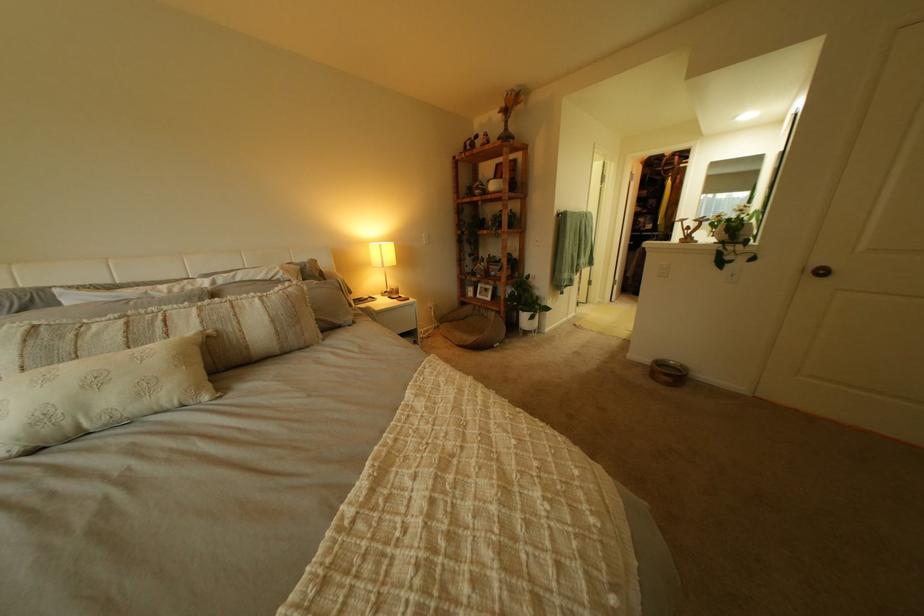
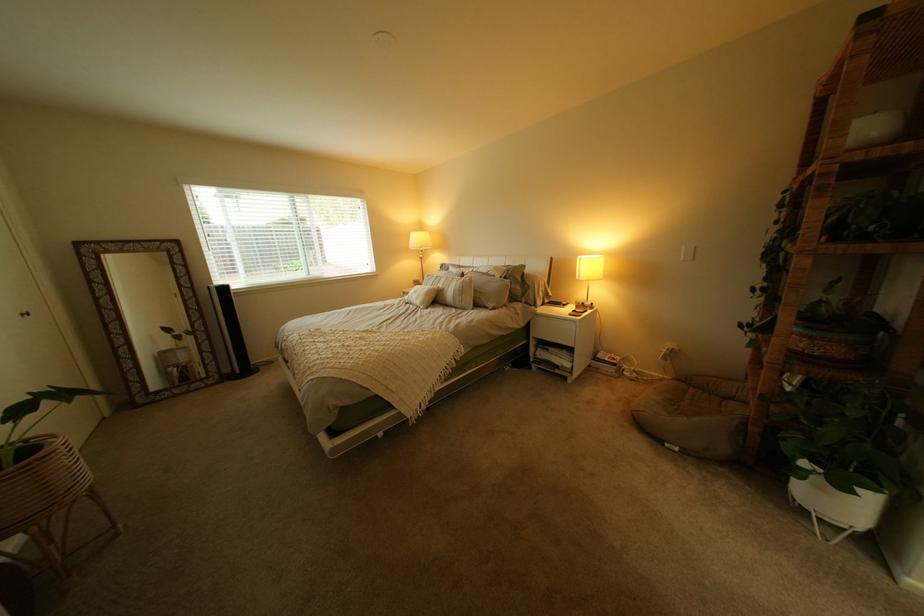
Where in the second image is the point corresponding to point (524, 277) from the first image?

(805, 354)